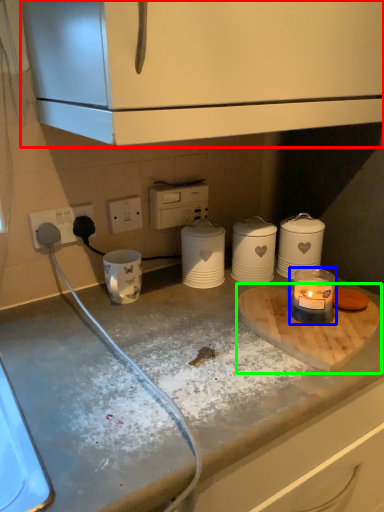
Question: Which object is positioned farthest from cabinetry (highlighted by a red box)? Select from candle holder (highlighted by a blue box) and cutting board (highlighted by a green box).

Choices:
 (A) candle holder
 (B) cutting board

Answer: (B)